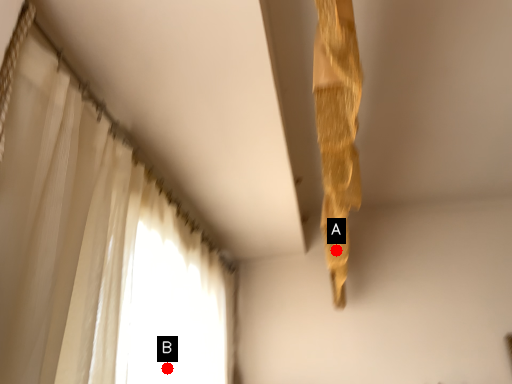
Question: Two points are circled on the image, labeled by A and B beside each circle. Which point is closer to the camera?

Choices:
 (A) A is closer
 (B) B is closer

Answer: (B)